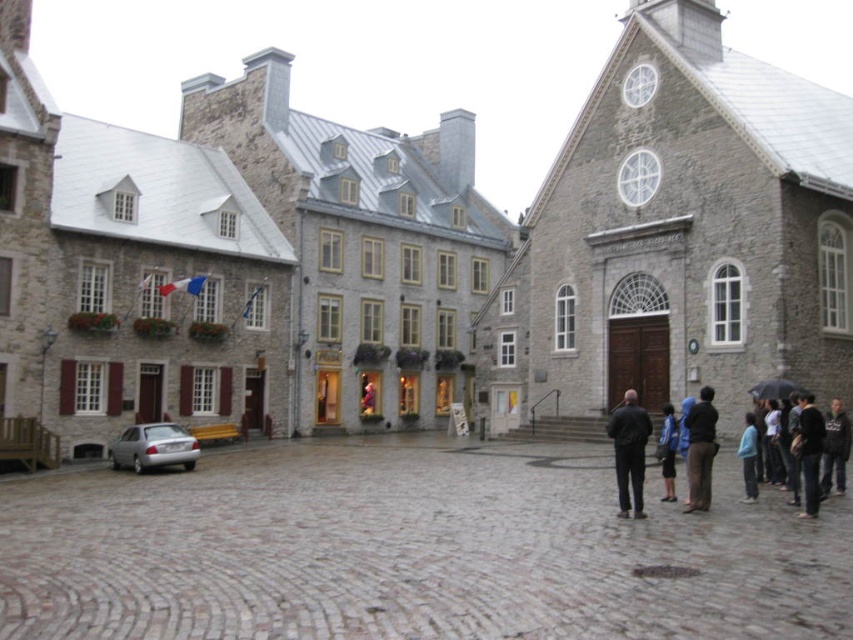
You are standing in the courtyard and want to place a new bench. The bench requires a space that is 1.2 meters wide. Is there enough space at the location of the dark brown leather jacket at center?

The dark brown leather jacket at center is located at point (x=700, y=449), but the description does not provide information about the available space or dimensions at that location. Therefore, it is not possible to determine if the bench will fit there based on the given information.

Please provide the 2D coordinates of the dark brown leather jacket at center in the image.

The dark brown leather jacket at center is located at coordinates (700, 449).